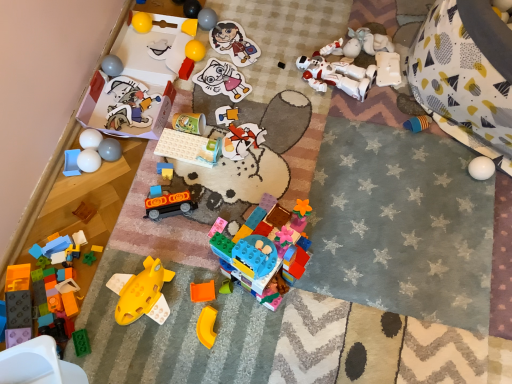
In order to click on free space that is in between white matte robot at center, which is counted as the 21th toy, starting from the left, and smooth yellow ball at upper center, the ninth toy from the right in this screenshot , I will do `click(260, 50)`.